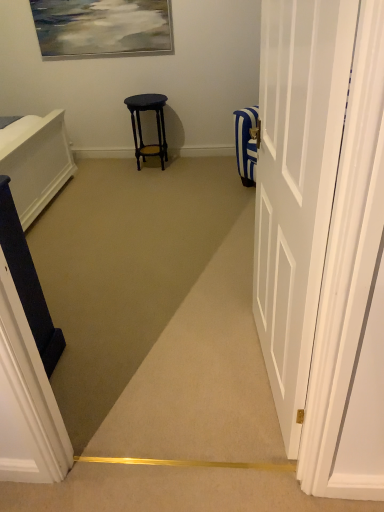
Question: Is white glossy door at right positioned in front of matte black stool at center?

Choices:
 (A) yes
 (B) no

Answer: (A)

Question: Is white glossy door at right wider than matte black stool at center?

Choices:
 (A) no
 (B) yes

Answer: (A)

Question: Does white glossy door at right appear on the right side of matte black stool at center?

Choices:
 (A) no
 (B) yes

Answer: (B)

Question: From the image's perspective, does white glossy door at right appear higher than matte black stool at center?

Choices:
 (A) yes
 (B) no

Answer: (B)

Question: Is white glossy door at right smaller than matte black stool at center?

Choices:
 (A) no
 (B) yes

Answer: (A)

Question: Considering the positions of point (292, 354) and point (23, 301), is point (292, 354) closer or farther from the camera than point (23, 301)?

Choices:
 (A) closer
 (B) farther

Answer: (A)

Question: From a real-world perspective, is white glossy door at right above or below dark blue fabric at left?

Choices:
 (A) below
 (B) above

Answer: (B)

Question: In terms of size, does white glossy door at right appear bigger or smaller than dark blue fabric at left?

Choices:
 (A) big
 (B) small

Answer: (A)

Question: Do you think white glossy door at right is within dark blue fabric at left, or outside of it?

Choices:
 (A) inside
 (B) outside

Answer: (B)

Question: In terms of width, does matte black stool at center look wider or thinner when compared to white glossy door at right?

Choices:
 (A) wide
 (B) thin

Answer: (A)

Question: Is point (155, 153) closer or farther from the camera than point (314, 327)?

Choices:
 (A) closer
 (B) farther

Answer: (B)

Question: In terms of size, does matte black stool at center appear bigger or smaller than white glossy door at right?

Choices:
 (A) small
 (B) big

Answer: (A)

Question: From the image's perspective, is matte black stool at center above or below white glossy door at right?

Choices:
 (A) above
 (B) below

Answer: (A)

Question: Considering the positions of point (165, 99) and point (46, 329), is point (165, 99) closer or farther from the camera than point (46, 329)?

Choices:
 (A) farther
 (B) closer

Answer: (A)

Question: Considering their positions, is matte black stool at center located in front of or behind dark blue fabric at left?

Choices:
 (A) behind
 (B) front

Answer: (A)